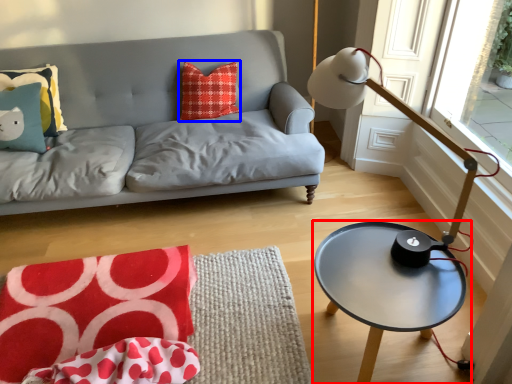
Question: Which of the following is the closest to the observer, coffee table (highlighted by a red box) or pillow (highlighted by a blue box)?

Choices:
 (A) coffee table
 (B) pillow

Answer: (A)